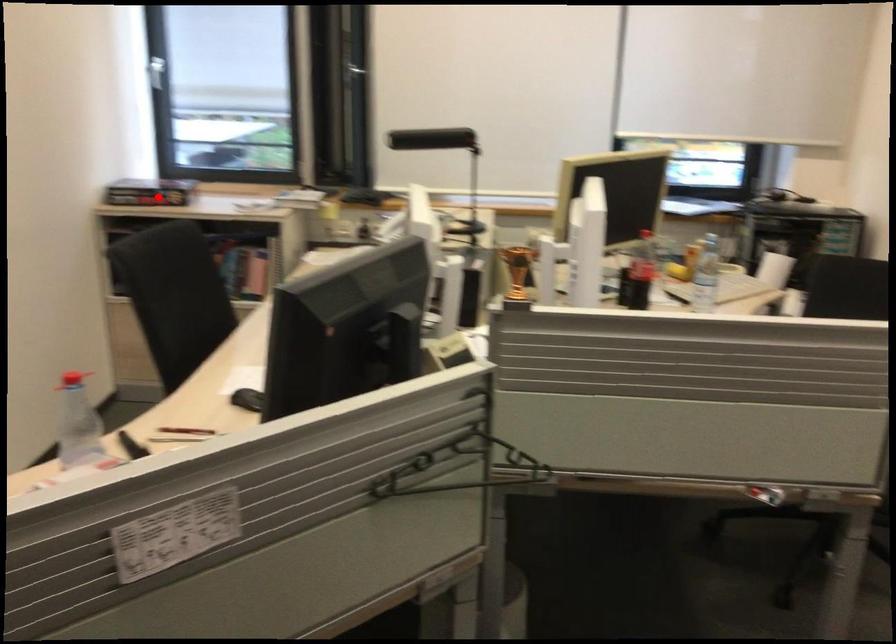
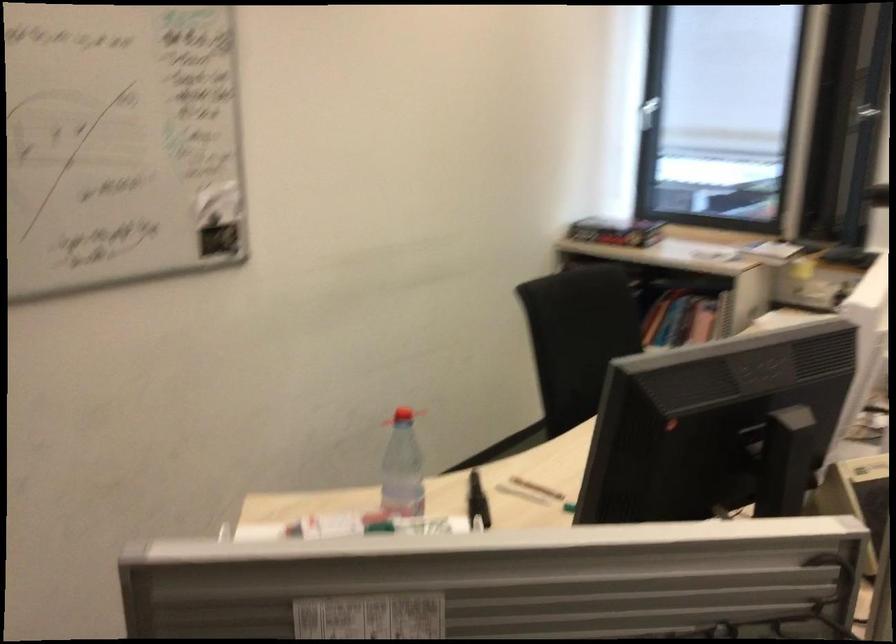
Question: I am providing you with two images of the same scene from different viewpoints. A red point is marked on the first image. Is the red point's position out of view in image 2?

Choices:
 (A) Yes
 (B) No

Answer: (B)